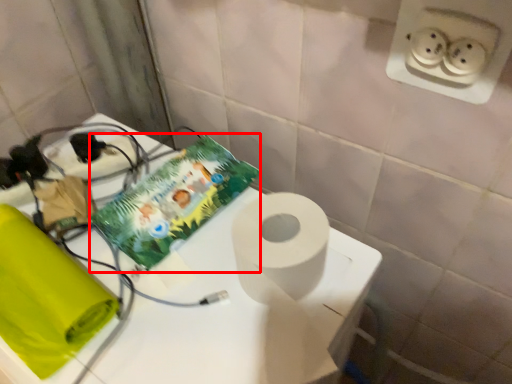
Question: From the image's perspective, what is the correct spatial positioning of comic book (annotated by the red box) in reference to table?

Choices:
 (A) above
 (B) below

Answer: (A)